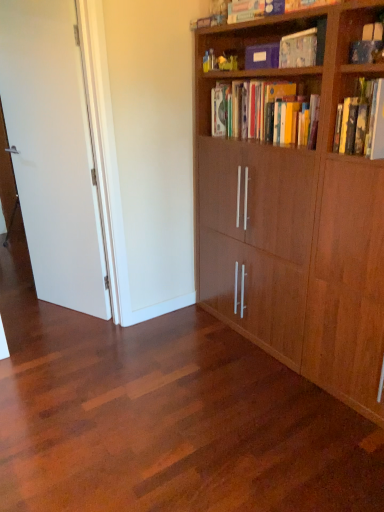
Describe the element at coordinates (52, 152) in the screenshot. Image resolution: width=384 pixels, height=512 pixels. I see `white matte door at left` at that location.

What do you see at coordinates (298, 49) in the screenshot? The width and height of the screenshot is (384, 512). I see `matte cardboard book at upper center, which is the second book in top-to-bottom order` at bounding box center [298, 49].

What do you see at coordinates (264, 113) in the screenshot? The height and width of the screenshot is (512, 384). I see `hardcover books at upper center, which is the 3th book from top to bottom` at bounding box center [264, 113].

At what (x,y) coordinates should I click in order to perform the action: click on hardcover books at upper center, which is the 3th book from top to bottom. Please return your answer as a coordinate pair (x, y). This screenshot has height=512, width=384. Looking at the image, I should click on (264, 113).

Locate an element on the screen. This screenshot has height=512, width=384. wooden bookcase at right is located at coordinates (297, 220).

Which of these two, hardcover books at upper center, which is the 1th book in bottom-to-top order, or matte blue book at upper center, which ranks as the first book in top-to-bottom order, is thinner?

→ hardcover books at upper center, which is the 1th book in bottom-to-top order, is thinner.

From a real-world perspective, is hardcover books at upper center, which is the 1th book in bottom-to-top order, positioned above or below matte blue book at upper center, arranged as the third book when ordered from the bottom?

hardcover books at upper center, which is the 1th book in bottom-to-top order, is below matte blue book at upper center, arranged as the third book when ordered from the bottom.

Can we say hardcover books at upper center, which is the 3th book from top to bottom, lies outside matte blue book at upper center, which ranks as the first book in top-to-bottom order?

Absolutely, hardcover books at upper center, which is the 3th book from top to bottom, is external to matte blue book at upper center, which ranks as the first book in top-to-bottom order.

Locate an element on the screen. the 1st book in front of the matte blue book at upper center, arranged as the third book when ordered from the bottom, starting your count from the anchor is located at coordinates tap(264, 113).

Is matte cardboard book at upper center, which appears as the 2th book when ordered from the bottom, facing away from shiny wood floor at center?

No, matte cardboard book at upper center, which appears as the 2th book when ordered from the bottom, is not facing the opposite direction of shiny wood floor at center.

Between matte cardboard book at upper center, which is the second book in top-to-bottom order, and shiny wood floor at center, which one has larger width?

shiny wood floor at center.

Is matte cardboard book at upper center, which is the second book in top-to-bottom order, with shiny wood floor at center?

No, matte cardboard book at upper center, which is the second book in top-to-bottom order, is not making contact with shiny wood floor at center.

Who is taller, white matte door at left or matte blue book at upper center, arranged as the third book when ordered from the bottom?

Standing taller between the two is white matte door at left.

Is matte blue book at upper center, arranged as the third book when ordered from the bottom, surrounded by white matte door at left?

That's incorrect, matte blue book at upper center, arranged as the third book when ordered from the bottom, is not inside white matte door at left.

From a real-world perspective, is white matte door at left under matte blue book at upper center, which ranks as the first book in top-to-bottom order?

Yes, from a real-world perspective, white matte door at left is below matte blue book at upper center, which ranks as the first book in top-to-bottom order.

Locate an element on the screen. the 3rd book above the white matte door at left (from the image's perspective) is located at coordinates (268, 8).

Is matte blue book at upper center, which ranks as the first book in top-to-bottom order, bigger or smaller than wooden bookcase at right?

matte blue book at upper center, which ranks as the first book in top-to-bottom order, is smaller than wooden bookcase at right.

Does matte blue book at upper center, arranged as the third book when ordered from the bottom, contain wooden bookcase at right?

No, wooden bookcase at right is not a part of matte blue book at upper center, arranged as the third book when ordered from the bottom.

Does matte blue book at upper center, which ranks as the first book in top-to-bottom order, turn towards wooden bookcase at right?

No, matte blue book at upper center, which ranks as the first book in top-to-bottom order, is not facing towards wooden bookcase at right.

At what (x,y) coordinates should I click in order to perform the action: click on bookcase that is in front of the matte blue book at upper center, arranged as the third book when ordered from the bottom. Please return your answer as a coordinate pair (x, y). Image resolution: width=384 pixels, height=512 pixels. Looking at the image, I should click on (297, 220).

Is white matte door at left next to matte cardboard book at upper center, which is the second book in top-to-bottom order?

white matte door at left and matte cardboard book at upper center, which is the second book in top-to-bottom order, are not in contact.

Is white matte door at left located outside matte cardboard book at upper center, which appears as the 2th book when ordered from the bottom?

white matte door at left lies outside matte cardboard book at upper center, which appears as the 2th book when ordered from the bottom,'s area.

From a real-world perspective, is white matte door at left located beneath matte cardboard book at upper center, which is the second book in top-to-bottom order?

Indeed, from a real-world perspective, white matte door at left is positioned beneath matte cardboard book at upper center, which is the second book in top-to-bottom order.

From the picture: Can you confirm if white matte door at left is shorter than matte cardboard book at upper center, which appears as the 2th book when ordered from the bottom?

Incorrect, the height of white matte door at left does not fall short of that of matte cardboard book at upper center, which appears as the 2th book when ordered from the bottom.

Measure the distance from matte cardboard book at upper center, which appears as the 2th book when ordered from the bottom, to hardcover books at upper center, which is the 1th book in bottom-to-top order.

The distance of matte cardboard book at upper center, which appears as the 2th book when ordered from the bottom, from hardcover books at upper center, which is the 1th book in bottom-to-top order, is 15.80 inches.

From a real-world perspective, relative to hardcover books at upper center, which is the 1th book in bottom-to-top order, is matte cardboard book at upper center, which is the second book in top-to-bottom order, vertically above or below?

In terms of real-world spatial position, matte cardboard book at upper center, which is the second book in top-to-bottom order, is above hardcover books at upper center, which is the 1th book in bottom-to-top order.

Is matte cardboard book at upper center, which appears as the 2th book when ordered from the bottom, taller than hardcover books at upper center, which is the 1th book in bottom-to-top order?

No.

Does point (19, 383) come farther from viewer compared to point (245, 10)?

That is True.

Are shiny wood floor at center and matte blue book at upper center, which ranks as the first book in top-to-bottom order, located far from each other?

Yes.

Is shiny wood floor at center aimed at matte blue book at upper center, which ranks as the first book in top-to-bottom order?

No, shiny wood floor at center is not turned towards matte blue book at upper center, which ranks as the first book in top-to-bottom order.

From a real-world perspective, who is located lower, shiny wood floor at center or matte blue book at upper center, arranged as the third book when ordered from the bottom?

shiny wood floor at center is physically lower.

Locate an element on the screen. This screenshot has width=384, height=512. book on the left of matte blue book at upper center, which ranks as the first book in top-to-bottom order is located at coordinates (264, 113).

The width and height of the screenshot is (384, 512). I want to click on plain in front of the matte cardboard book at upper center, which appears as the 2th book when ordered from the bottom, so click(x=170, y=421).

Looking at the image, which one is located closer to hardcover books at upper center, which is the 1th book in bottom-to-top order, matte blue book at upper center, arranged as the third book when ordered from the bottom, or wooden bookcase at right?

wooden bookcase at right.

Based on their spatial positions, is wooden bookcase at right or white matte door at left closer to matte cardboard book at upper center, which is the second book in top-to-bottom order?

Based on the image, wooden bookcase at right appears to be nearer to matte cardboard book at upper center, which is the second book in top-to-bottom order.

Which object lies further to the anchor point white matte door at left, matte blue book at upper center, arranged as the third book when ordered from the bottom, or hardcover books at upper center, which is the 1th book in bottom-to-top order?

Among the two, matte blue book at upper center, arranged as the third book when ordered from the bottom, is located further to white matte door at left.

From the image, which object appears to be nearer to wooden bookcase at right, shiny wood floor at center or matte cardboard book at upper center, which appears as the 2th book when ordered from the bottom?

Among the two, matte cardboard book at upper center, which appears as the 2th book when ordered from the bottom, is located nearer to wooden bookcase at right.

Considering their positions, is matte blue book at upper center, arranged as the third book when ordered from the bottom, positioned further to wooden bookcase at right than shiny wood floor at center?

matte blue book at upper center, arranged as the third book when ordered from the bottom.

Which object lies further to the anchor point matte blue book at upper center, arranged as the third book when ordered from the bottom, shiny wood floor at center or hardcover books at upper center, which is the 1th book in bottom-to-top order?

shiny wood floor at center lies further to matte blue book at upper center, arranged as the third book when ordered from the bottom, than the other object.

In the scene shown: Based on their spatial positions, is white matte door at left or shiny wood floor at center further from matte blue book at upper center, arranged as the third book when ordered from the bottom?

Among the two, shiny wood floor at center is located further to matte blue book at upper center, arranged as the third book when ordered from the bottom.

Based on their spatial positions, is shiny wood floor at center or white matte door at left closer to wooden bookcase at right?

Based on the image, shiny wood floor at center appears to be nearer to wooden bookcase at right.

Where is `door between matte cardboard book at upper center, which appears as the 2th book when ordered from the bottom, and shiny wood floor at center from top to bottom`? Image resolution: width=384 pixels, height=512 pixels. door between matte cardboard book at upper center, which appears as the 2th book when ordered from the bottom, and shiny wood floor at center from top to bottom is located at coordinates (52, 152).

Image resolution: width=384 pixels, height=512 pixels. I want to click on bookcase between matte blue book at upper center, which ranks as the first book in top-to-bottom order, and shiny wood floor at center, in the vertical direction, so click(297, 220).

I want to click on door between matte blue book at upper center, arranged as the third book when ordered from the bottom, and shiny wood floor at center, in the vertical direction, so click(x=52, y=152).

I want to click on door between hardcover books at upper center, which is the 3th book from top to bottom, and shiny wood floor at center, in the vertical direction, so click(x=52, y=152).